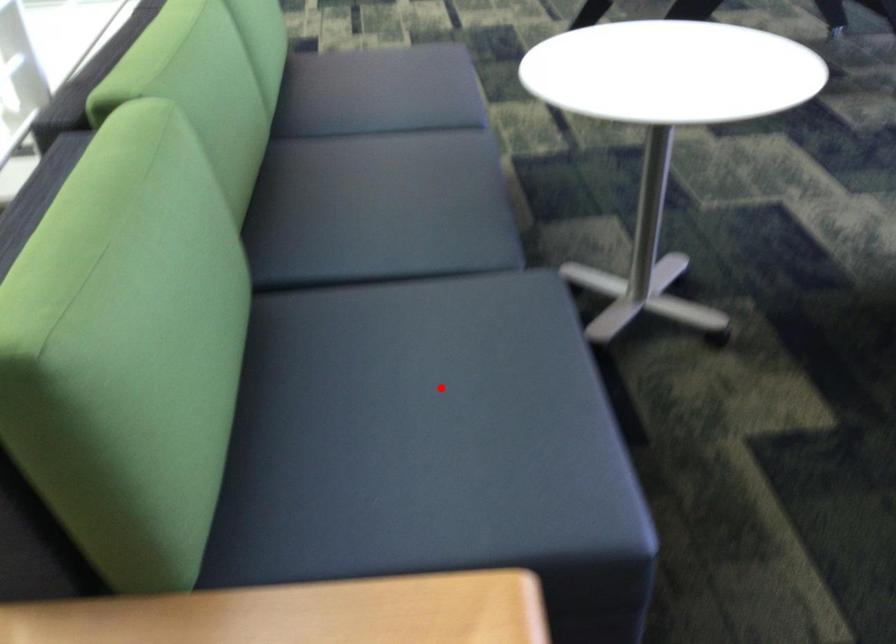
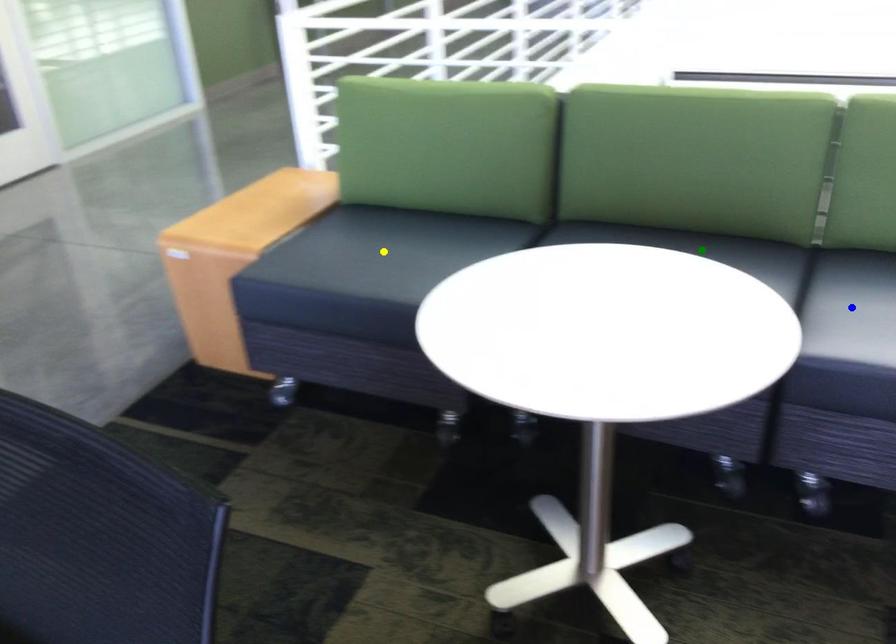
Question: I am providing you with two images of the same scene from different viewpoints. A red point is marked on the first image. You are given multiple points on the second image. Can you choose the point in image 2 that corresponds to the point in image 1?

Choices:
 (A) yellow point
 (B) blue point
 (C) green point

Answer: (A)